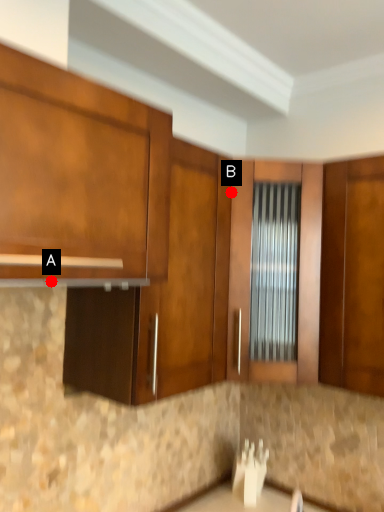
Question: Two points are circled on the image, labeled by A and B beside each circle. Which point appears farthest from the camera in this image?

Choices:
 (A) A is further
 (B) B is further

Answer: (B)